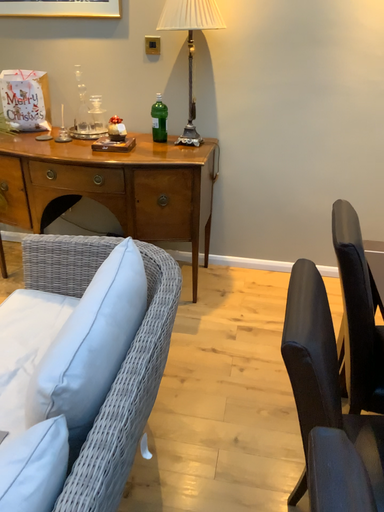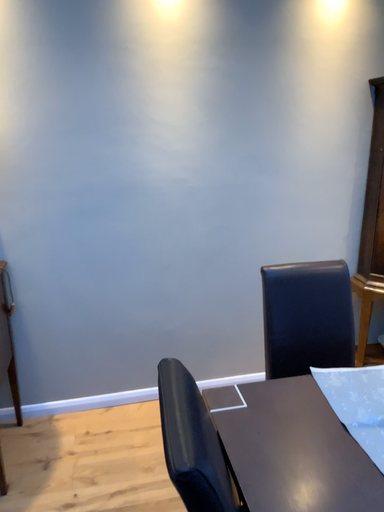
Question: Which way did the camera rotate in the video?

Choices:
 (A) rotated downward
 (B) rotated upward

Answer: (B)